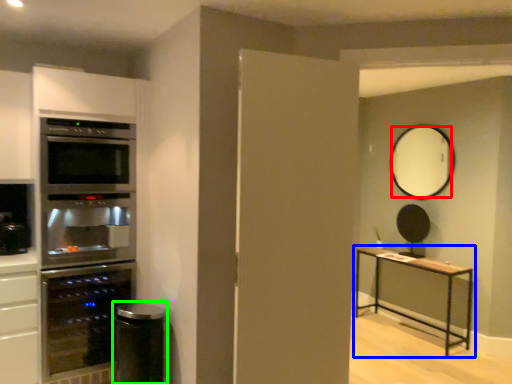
Question: Which is farther away from mirror (highlighted by a red box)? table (highlighted by a blue box) or appliance (highlighted by a green box)?

Choices:
 (A) table
 (B) appliance

Answer: (B)